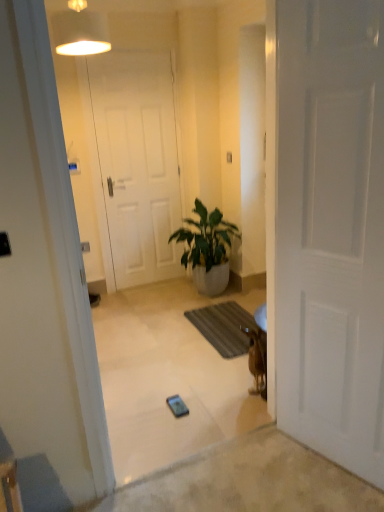
You are a GUI agent. You are given a task and a screenshot of the screen. Output one action in this format:
    pyautogui.click(x=<x>, y=<y>)
    Task: Click on the vacant area situated to the left side of white matte door at center, which is the 2th door in left-to-right order
    
    Given the screenshot: What is the action you would take?
    pyautogui.click(x=274, y=469)